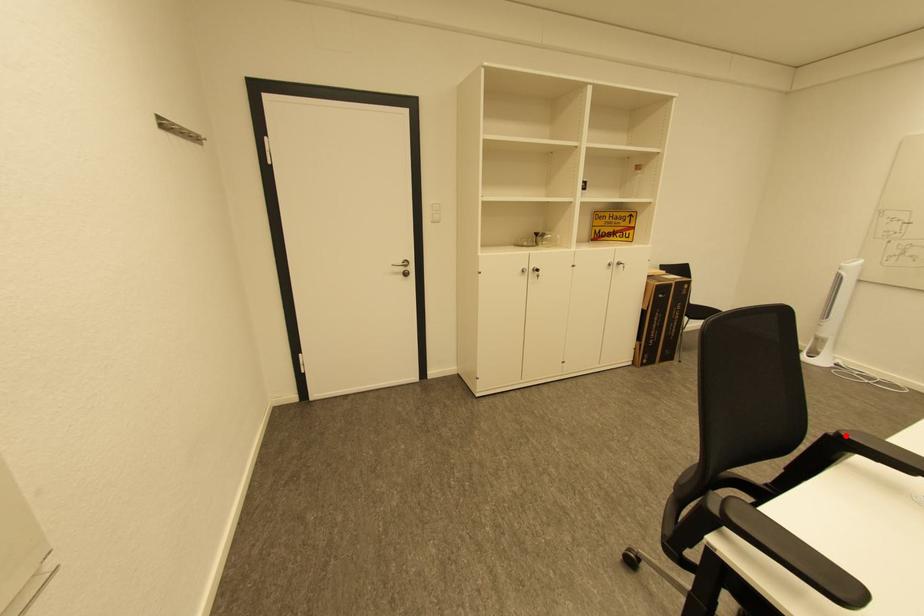
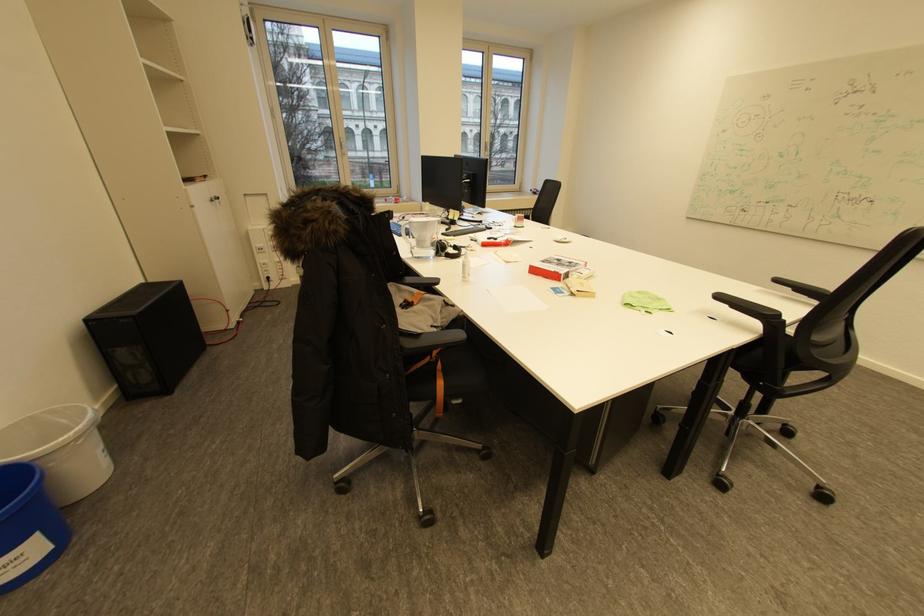
In the second image, find the point that corresponds to the highlighted location in the first image.

(784, 315)